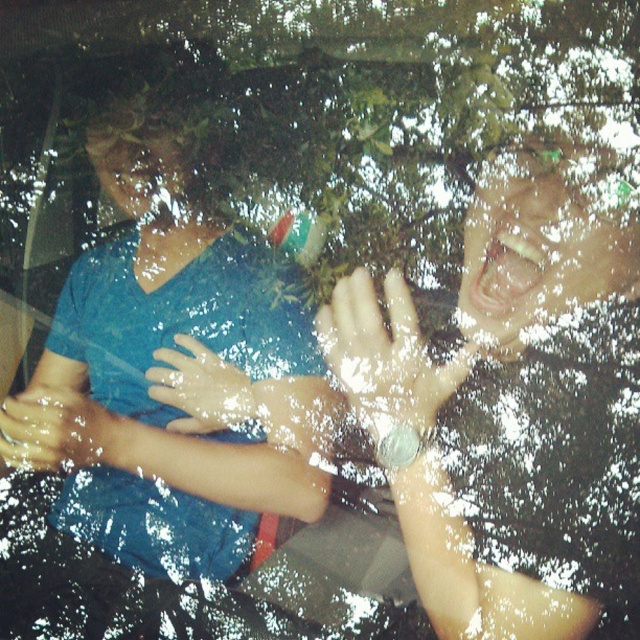
You are standing at the point with coordinates point (397, 323) and want to move towards the point with coordinates point (52, 436). Which direction should you move?

Since point (397, 323) is in front of point (52, 436), you should move backward to reach the point (52, 436).

You are observing two points in the scene. Which point is nearer to you, point (125, 518) or point (150, 392)?

Point (125, 518) is closer to the viewer than point (150, 392).